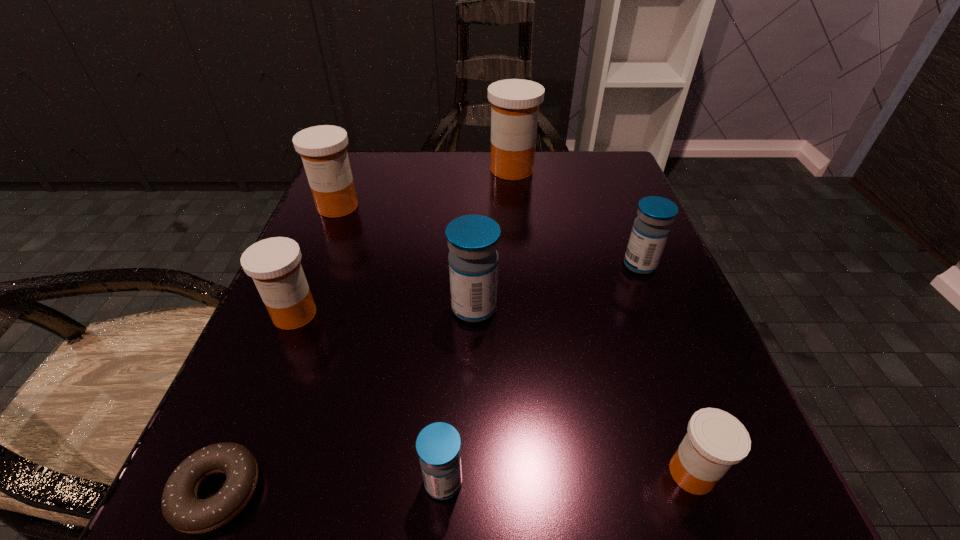
The width and height of the screenshot is (960, 540). I want to click on the second orange medicine from right to left, so click(515, 103).

The width and height of the screenshot is (960, 540). I want to click on the tallest object, so click(x=515, y=103).

This screenshot has width=960, height=540. Find the location of `the sixth nearest medicine`. the sixth nearest medicine is located at coordinates (323, 150).

Where is `the seventh nearest object`? The image size is (960, 540). the seventh nearest object is located at coordinates (323, 150).

Find the location of a particular element. This screenshot has height=540, width=960. the biggest blue medicine is located at coordinates (473, 240).

Find the location of a particular element. the farthest blue medicine is located at coordinates coord(651,228).

The image size is (960, 540). I want to click on the third farthest object, so click(651, 228).

This screenshot has height=540, width=960. In order to click on the third farthest orange medicine in this screenshot , I will do `click(274, 264)`.

Identify the location of the nearest orange medicine. This screenshot has height=540, width=960. (716, 440).

At what (x,y) coordinates should I click in order to perform the action: click on the rightmost orange medicine. Please return your answer as a coordinate pair (x, y). Looking at the image, I should click on (716, 440).